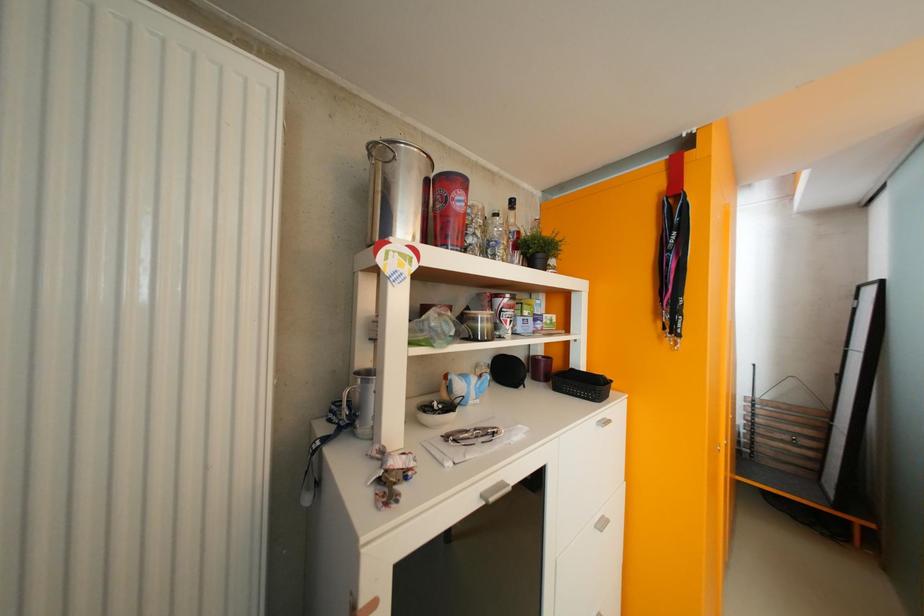
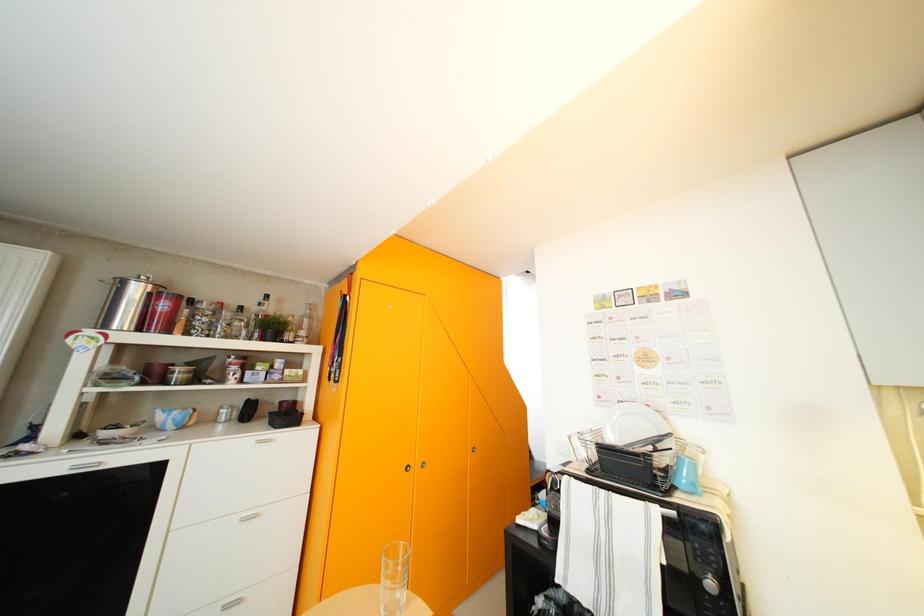
The images are taken continuously from a first-person perspective. In which direction are you moving?

The cameraman moved toward right, backward.